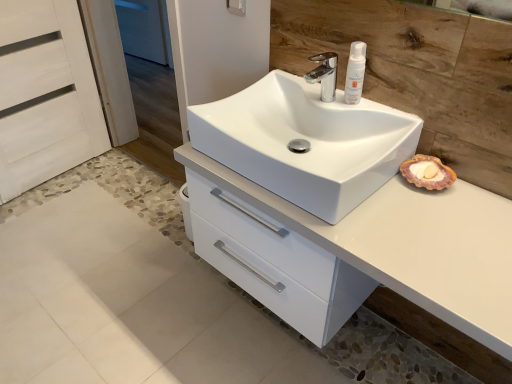
I want to click on free space in front of white glossy sink at center, so [388, 242].